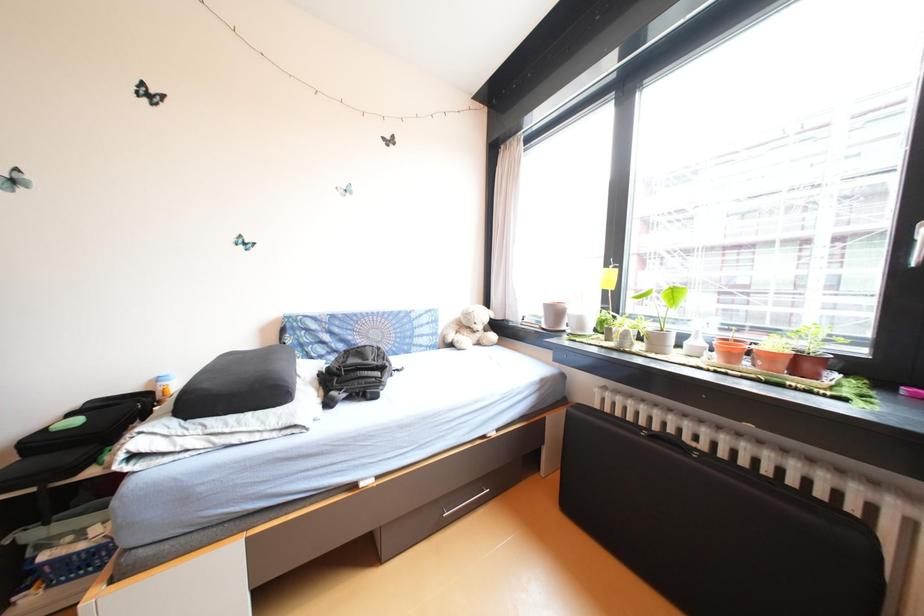
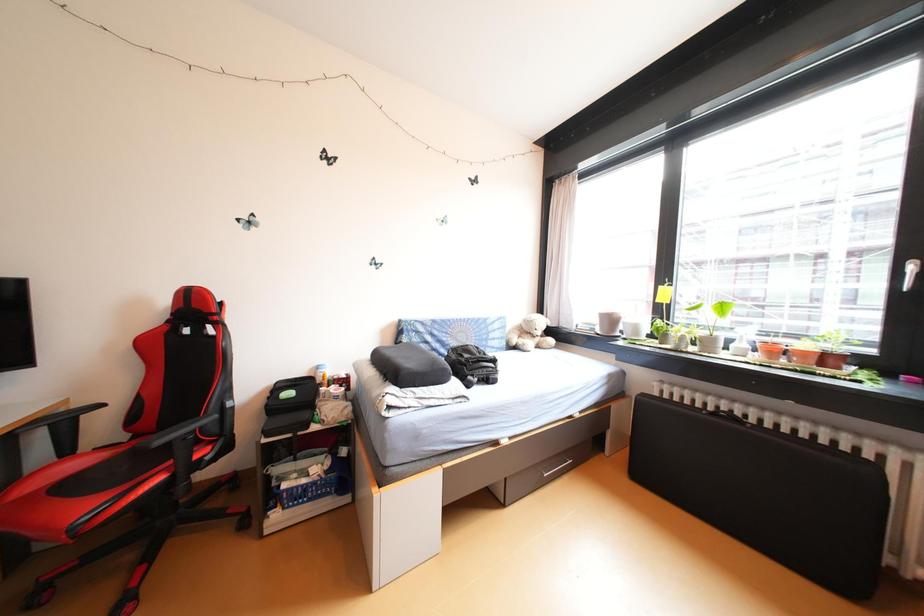
Question: How did the camera likely rotate?

Choices:
 (A) Left
 (B) Right
 (C) Up
 (D) Down

Answer: (C)